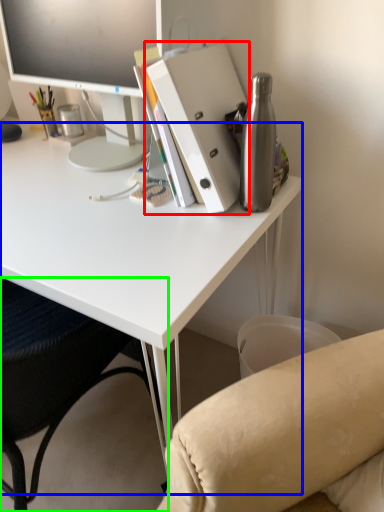
Question: Based on their relative distances, which object is nearer to paperback book (highlighted by a red box)? Choose from desk (highlighted by a blue box) and chair (highlighted by a green box).

Choices:
 (A) desk
 (B) chair

Answer: (A)